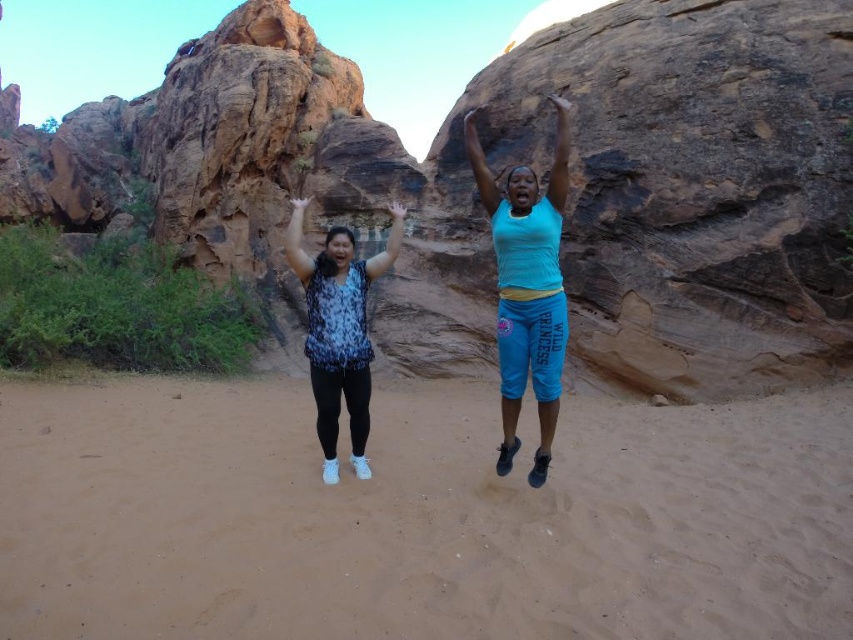
Is point (397, 212) farther from viewer compared to point (555, 186)?

Yes, it is.

This screenshot has height=640, width=853. What do you see at coordinates (339, 330) in the screenshot? I see `blue printed blouse at center` at bounding box center [339, 330].

Measure the distance between blue printed blouse at center and camera.

The distance of blue printed blouse at center from camera is 134.86 feet.

Where is `blue printed blouse at center`? blue printed blouse at center is located at coordinates (339, 330).

Is blue fabric arm at center below blue fabric arm at upper center?

Correct, blue fabric arm at center is located below blue fabric arm at upper center.

Who is more forward, (x=558, y=188) or (x=482, y=179)?

Point (x=558, y=188) is in front.

Between point (566, 120) and point (496, 189), which one is positioned in front?

Point (566, 120) is more forward.

What are the coordinates of `blue fabric arm at center` in the screenshot? It's located at (560, 154).

Can you confirm if blue printed blouse at center is wider than matte black arm at center?

Yes, blue printed blouse at center is wider than matte black arm at center.

At what (x,y) coordinates should I click in order to perform the action: click on blue printed blouse at center. Please return your answer as a coordinate pair (x, y). The height and width of the screenshot is (640, 853). Looking at the image, I should click on (339, 330).

Where is `blue printed blouse at center`? blue printed blouse at center is located at coordinates (339, 330).